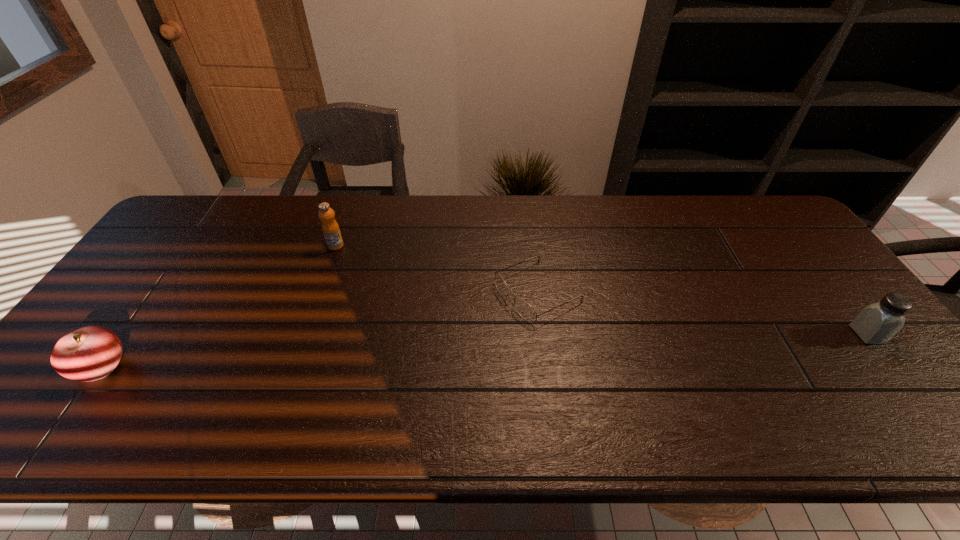
Locate an element on the screen. The height and width of the screenshot is (540, 960). vacant space positioned 0.190m on the front-facing side of the spectacles is located at coordinates (441, 341).

Where is `vacant space located on the front label of the orange juice`? The height and width of the screenshot is (540, 960). vacant space located on the front label of the orange juice is located at coordinates (353, 254).

Locate an element on the screen. The height and width of the screenshot is (540, 960). vacant area located 0.060m on the front label of the orange juice is located at coordinates (356, 255).

In order to click on vacant space positioned 0.240m on the front label of the orange juice in this screenshot , I will do `click(402, 279)`.

Locate an element on the screen. The image size is (960, 540). object situated at the near edge is located at coordinates (90, 353).

Where is `object that is at the left edge`? object that is at the left edge is located at coordinates (90, 353).

I want to click on object that is at the right edge, so click(x=877, y=323).

Locate an element on the screen. The height and width of the screenshot is (540, 960). object situated at the near left corner is located at coordinates (90, 353).

At what (x,y) coordinates should I click in order to perform the action: click on vacant space at the far edge of the desktop. Please return your answer as a coordinate pair (x, y). This screenshot has height=540, width=960. Looking at the image, I should click on (666, 195).

Find the location of `vacant space at the near edge`. vacant space at the near edge is located at coordinates (681, 394).